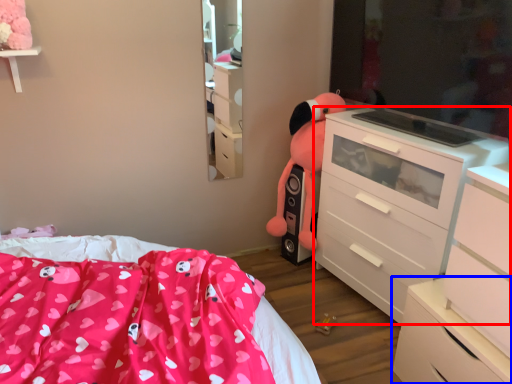
Question: Which of the following is the closest to the observer, chest of drawers (highlighted by a red box) or chest of drawers (highlighted by a blue box)?

Choices:
 (A) chest of drawers
 (B) chest of drawers

Answer: (B)